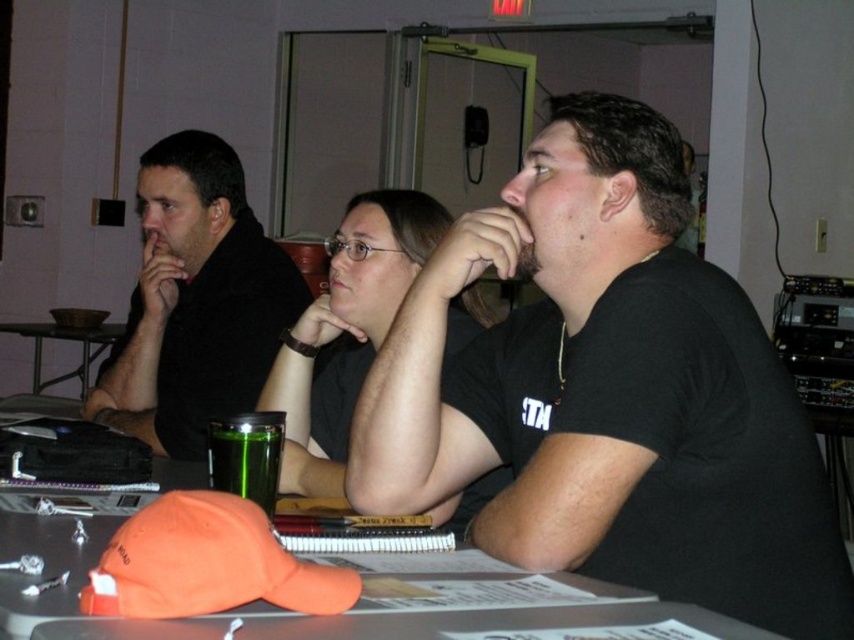
Does matte black shirt at left appear on the left side of green glass at center?

Correct, you'll find matte black shirt at left to the left of green glass at center.

I want to click on matte black shirt at left, so click(x=196, y=300).

Locate an element on the screen. The height and width of the screenshot is (640, 854). matte black shirt at left is located at coordinates tap(196, 300).

Is point (396, 572) positioned in front of point (86, 342)?

Yes, point (396, 572) is in front of point (86, 342).

Does orange fabric cap at center appear on the left side of metallic dark gray table at left?

No, orange fabric cap at center is not to the left of metallic dark gray table at left.

Where is `orange fabric cap at center`? The width and height of the screenshot is (854, 640). orange fabric cap at center is located at coordinates (44, 563).

Is the position of matte black shirt at left less distant than that of metallic dark gray table at left?

Yes, it is in front of metallic dark gray table at left.

Can you confirm if matte black shirt at left is positioned above metallic dark gray table at left?

Correct, matte black shirt at left is located above metallic dark gray table at left.

Between point (211, 292) and point (60, 337), which one is positioned in front?

Point (211, 292)

Where is `matte black shirt at left`? This screenshot has width=854, height=640. matte black shirt at left is located at coordinates (196, 300).